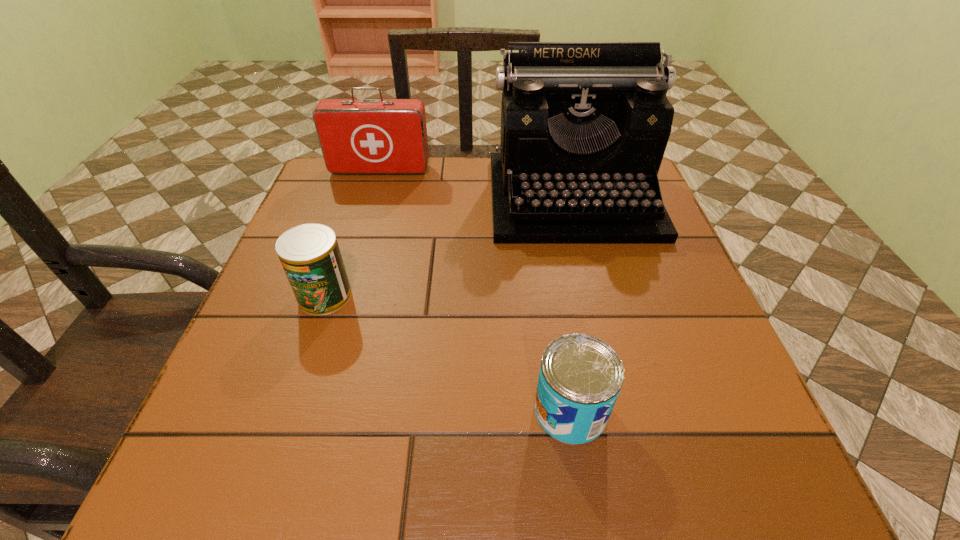
Find the location of a particular element. The height and width of the screenshot is (540, 960). typewriter at the far edge is located at coordinates (584, 125).

The width and height of the screenshot is (960, 540). Find the location of `the first-aid kit at the far edge`. the first-aid kit at the far edge is located at coordinates (357, 136).

Locate an element on the screen. object located at the near edge is located at coordinates (580, 377).

The width and height of the screenshot is (960, 540). I want to click on the first-aid kit present at the left edge, so click(357, 136).

Where is `can situated at the left edge`? The height and width of the screenshot is (540, 960). can situated at the left edge is located at coordinates (310, 256).

What are the coordinates of `object at the right edge` in the screenshot? It's located at (584, 125).

Where is `object present at the far left corner`? This screenshot has width=960, height=540. object present at the far left corner is located at coordinates (357, 136).

This screenshot has width=960, height=540. I want to click on object at the far right corner, so click(x=584, y=125).

I want to click on free space at the far edge of the desktop, so pos(427,198).

Identify the location of vacant position at the near edge of the desktop. (602, 461).